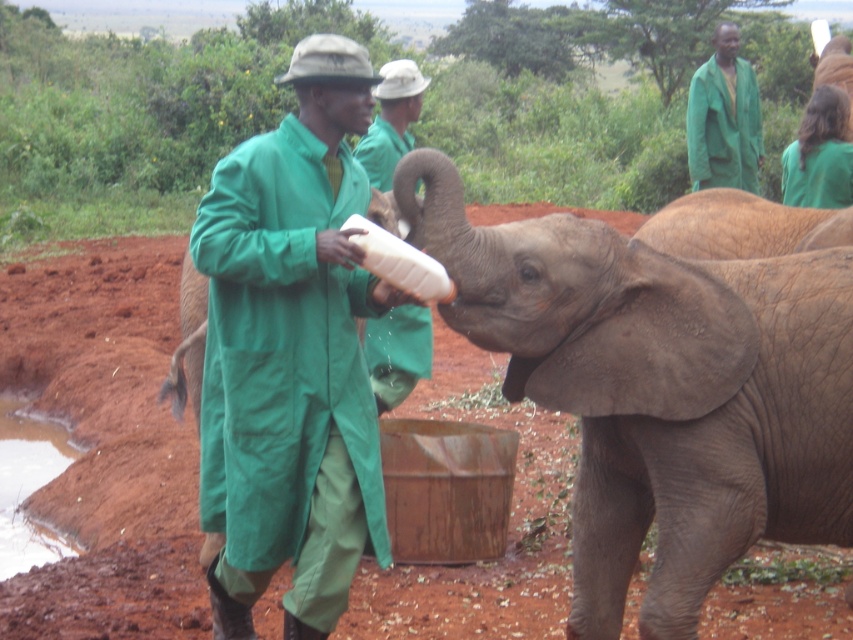
Is green matte coat at center behind green fabric coat at upper right?

That is False.

Find the location of a particular element. green matte coat at center is located at coordinates (397, 353).

Who is more forward, (381, 400) or (724, 150)?

Point (381, 400)

In order to click on green matte coat at center in this screenshot , I will do `click(397, 353)`.

Does green fabric coat at center appear over gray matte elephant at right?

No.

Describe the element at coordinates (289, 356) in the screenshot. I see `green fabric coat at center` at that location.

The height and width of the screenshot is (640, 853). What are the coordinates of `green fabric coat at center` in the screenshot? It's located at (289, 356).

How distant is gray textured elephant at center from gray matte elephant at right?

A distance of 5.16 feet exists between gray textured elephant at center and gray matte elephant at right.

Between point (610, 388) and point (650, 230), which one is positioned in front?

Point (610, 388) is more forward.

Describe the element at coordinates (659, 388) in the screenshot. I see `gray textured elephant at center` at that location.

Where is `gray textured elephant at center`? The height and width of the screenshot is (640, 853). gray textured elephant at center is located at coordinates (659, 388).